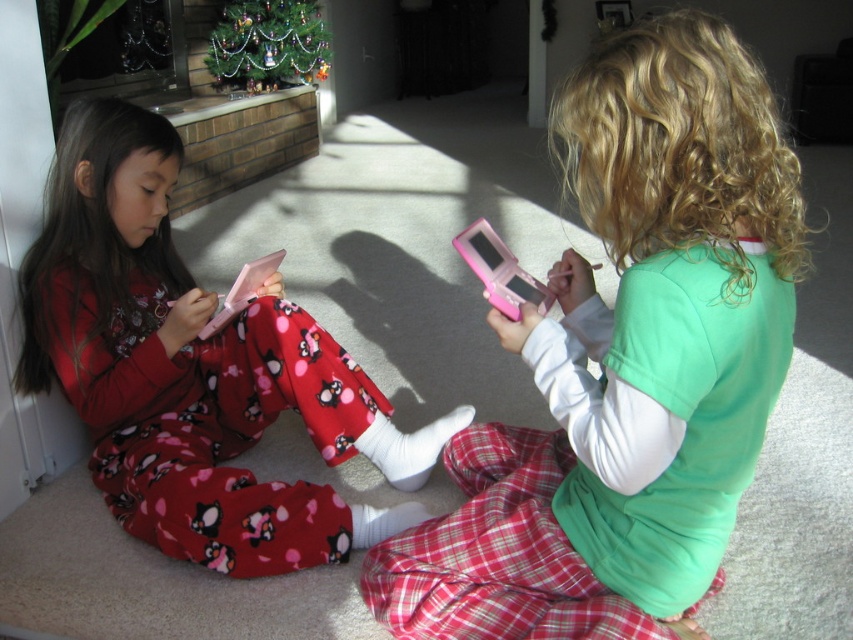
Who is lower down, matte pink toy at center or matte pink tablet at left?

matte pink toy at center

Which of these two, matte pink toy at center or matte pink tablet at left, stands taller?

matte pink toy at center

Identify the location of matte pink toy at center. (625, 364).

I want to click on matte pink toy at center, so click(x=625, y=364).

Consider the image. Is matte pink tablet at left bigger than pink plastic toy at center?

Correct, matte pink tablet at left is larger in size than pink plastic toy at center.

Does matte pink tablet at left appear under pink plastic toy at center?

Yes.

Who is more distant from viewer, (349, 515) or (508, 250)?

The point (349, 515) is more distant.

The height and width of the screenshot is (640, 853). In order to click on matte pink tablet at left in this screenshot , I will do `click(193, 369)`.

Which is above, matte pink toy at center or pink plastic toy at center?

pink plastic toy at center is above.

Between point (763, 100) and point (503, 280), which one is positioned in front?

Positioned in front is point (763, 100).

Locate an element on the screen. The width and height of the screenshot is (853, 640). matte pink toy at center is located at coordinates (625, 364).